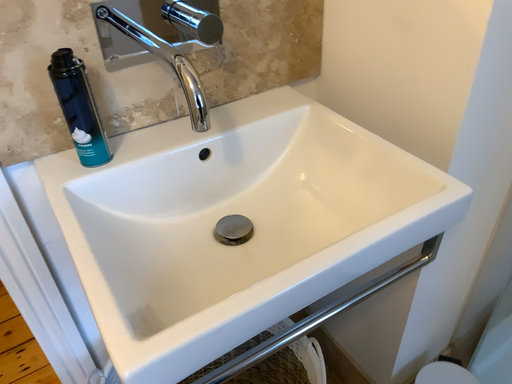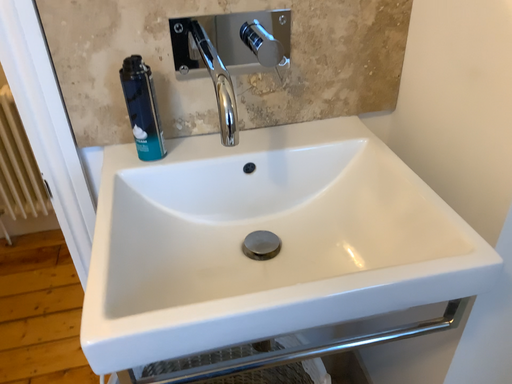
Question: How did the camera likely rotate when shooting the video?

Choices:
 (A) rotated left
 (B) rotated right

Answer: (A)